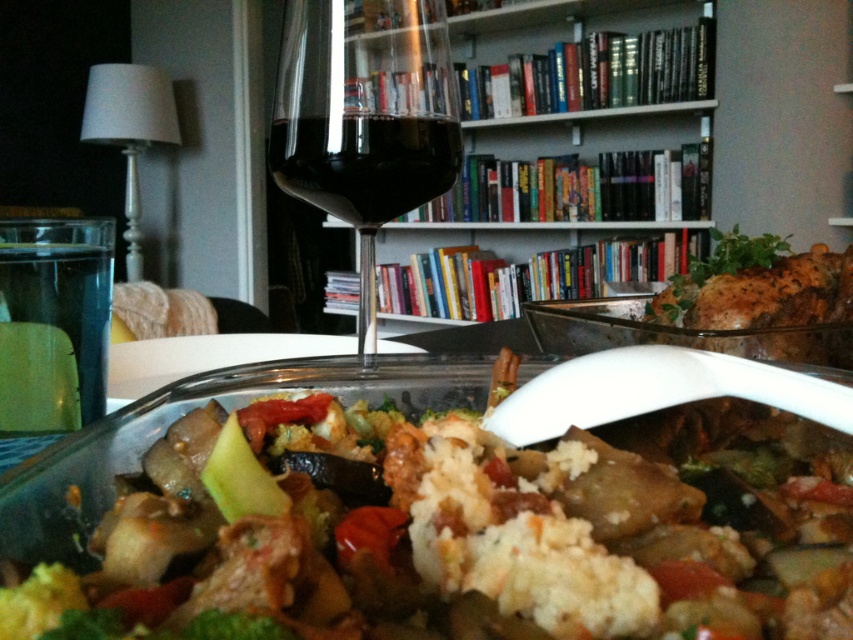
Question: Can you confirm if hardcover books at upper center is positioned below transparent glass wine glass at center?

Choices:
 (A) yes
 (B) no

Answer: (B)

Question: Does hardcover books at upper center have a lesser width compared to dark glass wine at center?

Choices:
 (A) yes
 (B) no

Answer: (B)

Question: Can you confirm if hardcover books at upper center is positioned above dark glass wine at center?

Choices:
 (A) no
 (B) yes

Answer: (B)

Question: Estimate the real-world distances between objects in this image. Which object is farther from the transparent glass wine glass at center?

Choices:
 (A) dark glass wine at center
 (B) hardcover books at upper center

Answer: (B)

Question: Which of the following is the closest to the observer?

Choices:
 (A) transparent glass wine glass at center
 (B) white creamy rice at center
 (C) hardcover books at upper center

Answer: (B)

Question: Estimate the real-world distances between objects in this image. Which object is farther from the transparent glass wine glass at center?

Choices:
 (A) white creamy rice at center
 (B) dark glass wine at center

Answer: (A)